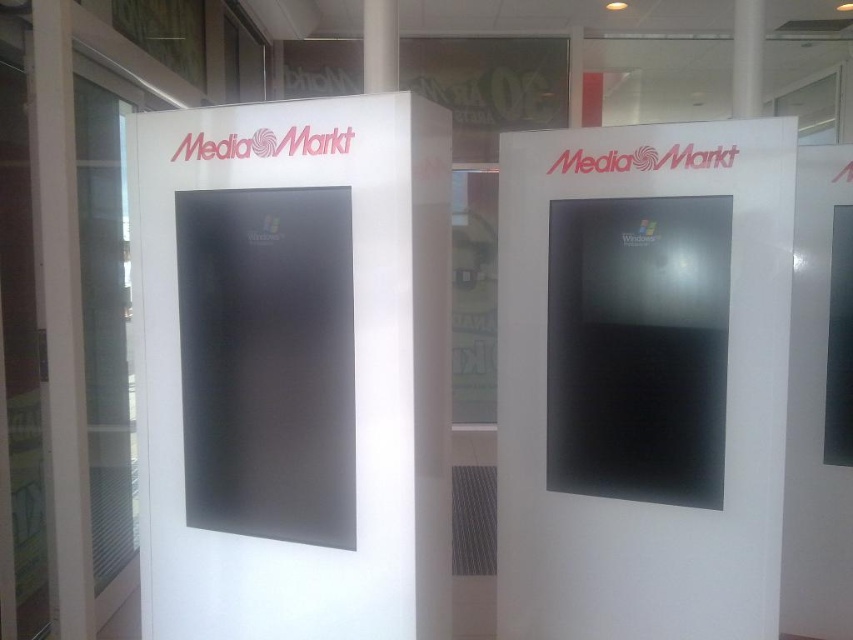
Is point (45, 200) more distant than point (370, 22)?

That is False.

Who is lower down, white glossy pillar at left or white matte pillar at center?

white glossy pillar at left is below.

Who is more forward, [67,99] or [396,44]?

Point [67,99] is in front.

Where is `white glossy pillar at left`? The width and height of the screenshot is (853, 640). white glossy pillar at left is located at coordinates (61, 317).

Between point (143, 307) and point (369, 8), which one is positioned in front?

Positioned in front is point (143, 307).

What do you see at coordinates (351, 365) in the screenshot?
I see `satin black monitor at center` at bounding box center [351, 365].

The image size is (853, 640). I want to click on satin black monitor at center, so click(x=351, y=365).

Which is more to the left, satin black monitor at center or white glossy display at center?

From the viewer's perspective, satin black monitor at center appears more on the left side.

Which is behind, point (184, 144) or point (573, 148)?

Positioned behind is point (573, 148).

Does point (215, 129) come behind point (764, 385)?

No, (215, 129) is in front of (764, 385).

Locate an element on the screen. The height and width of the screenshot is (640, 853). satin black monitor at center is located at coordinates pyautogui.click(x=351, y=365).